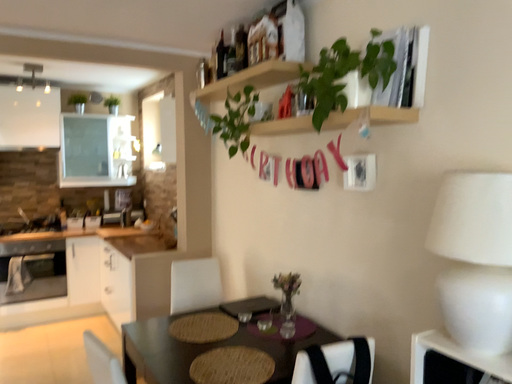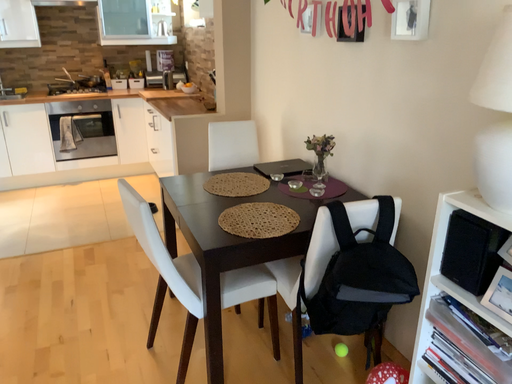
Question: Which way did the camera rotate in the video?

Choices:
 (A) rotated left
 (B) rotated right

Answer: (A)